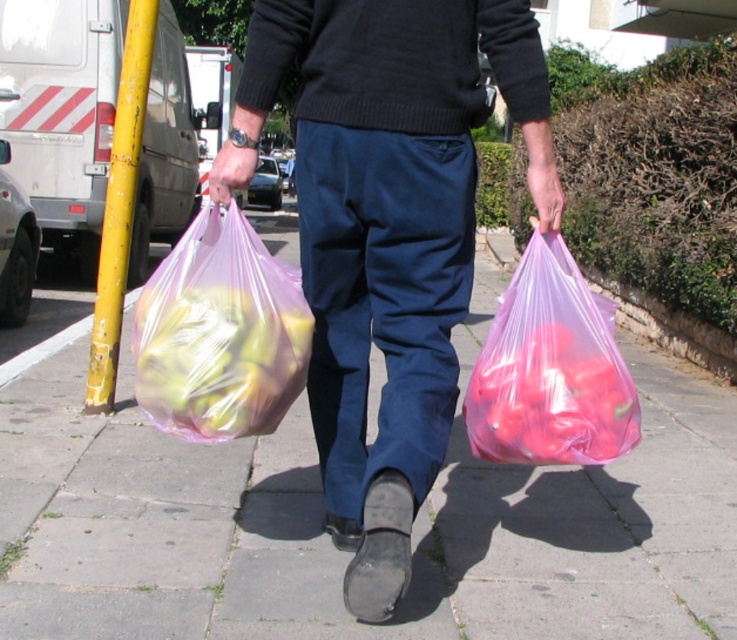
Does transparent plastic bag at center appear over white matte van at left?

Incorrect, transparent plastic bag at center is not positioned above white matte van at left.

Does point (160, 444) come behind point (13, 48)?

No, it is in front of (13, 48).

Is point (472, 458) less distant than point (80, 214)?

Yes, it is.

Find the location of a particular element. transparent plastic bag at center is located at coordinates (349, 556).

Does translucent plastic bag at left have a smaller size compared to yellow painted metal pole at left?

Yes.

Is point (220, 372) behind point (128, 182)?

No, it is not.

Which is in front, point (270, 326) or point (111, 230)?

Point (270, 326) is more forward.

Locate an element on the screen. translucent plastic bag at left is located at coordinates (220, 333).

Does white matte van at left have a smaller size compared to translucent pink plastic bag at lower right?

Incorrect, white matte van at left is not smaller in size than translucent pink plastic bag at lower right.

Who is positioned more to the right, white matte van at left or translucent pink plastic bag at lower right?

translucent pink plastic bag at lower right

Does point (29, 129) lie behind point (525, 401)?

Yes, it is.

This screenshot has width=737, height=640. Find the location of `white matte van at left`. white matte van at left is located at coordinates (60, 112).